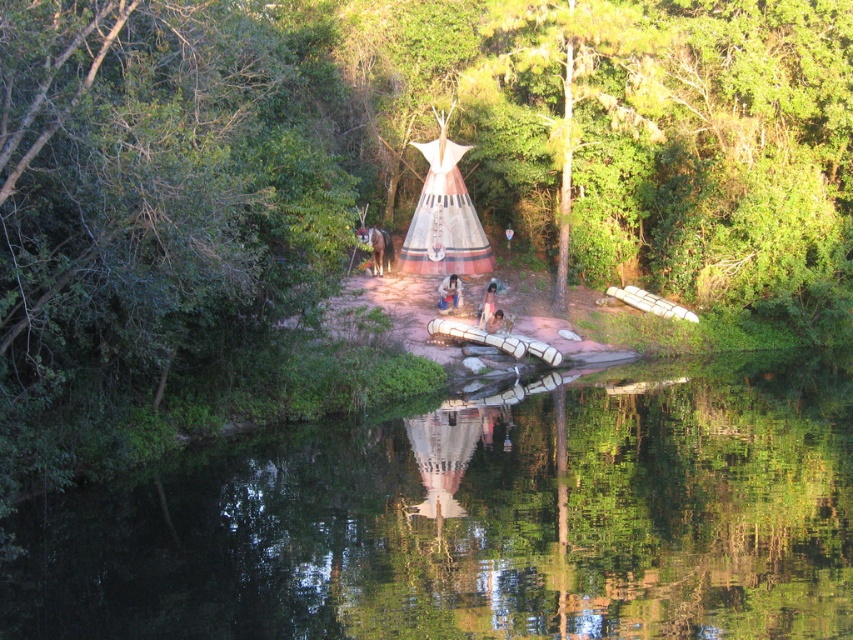
You are standing in front of the teepee and want to take a photo of both the brown fuzzy horse at center and the smooth skin face at center. Which one should you focus on first to ensure both are in clear view?

You should focus on the brown fuzzy horse at center first since it is closer to the viewer than the smooth skin face at center, ensuring both will be in clear view when focused properly.

You are a photographer standing at the camera position. You want to capture a clear photo of the smooth skin face at center. What is the minimum distance you need to maintain to ensure the face is in focus?

The smooth skin face at center and camera are 42.11 meters apart. To ensure the face is in focus, you should maintain a distance of at least 42.11 meters.